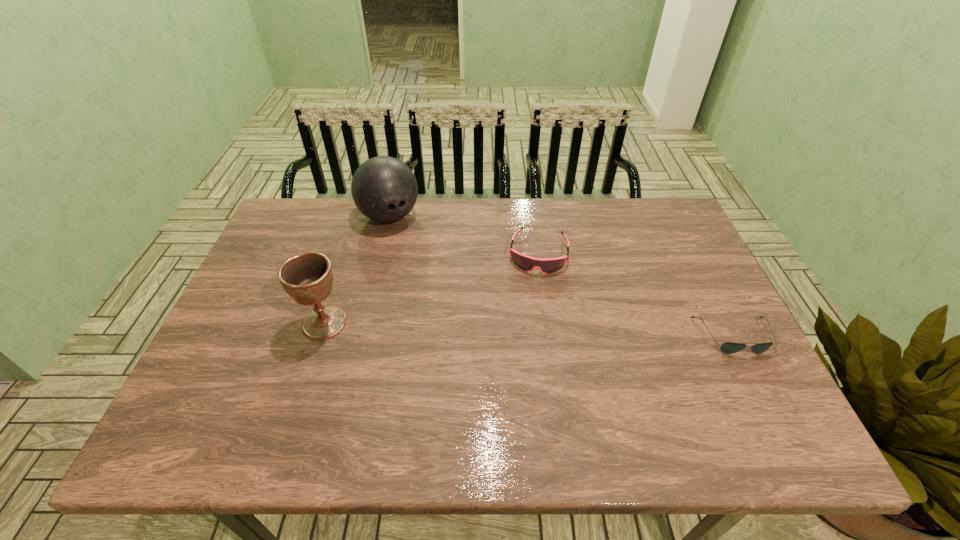
Find the location of a particular element. This screenshot has height=540, width=960. free location located on the front-facing side of the third object from left to right is located at coordinates (523, 363).

This screenshot has height=540, width=960. Identify the location of vacant space situated 0.350m on the grip area of the bowling ball. (452, 306).

Locate an element on the screen. free location located 0.120m on the grip area of the bowling ball is located at coordinates (418, 255).

You are a GUI agent. You are given a task and a screenshot of the screen. Output one action in this format:
    pyautogui.click(x=<x>, y=<y>)
    Task: Click on the vacant space located on the grip area of the bowling ball
    
    Given the screenshot: What is the action you would take?
    coord(458,314)

I want to click on goggles positioned at the far edge, so click(549, 265).

This screenshot has width=960, height=540. I want to click on bowling ball present at the far edge, so point(384,189).

Where is `object situated at the right edge`? This screenshot has width=960, height=540. object situated at the right edge is located at coordinates (728, 347).

In the image, there is a desktop. Find the location of `free space at the far edge`. free space at the far edge is located at coordinates (570, 198).

I want to click on vacant region at the near edge of the desktop, so click(x=665, y=392).

This screenshot has height=540, width=960. In order to click on vacant space at the left edge in this screenshot , I will do point(263,276).